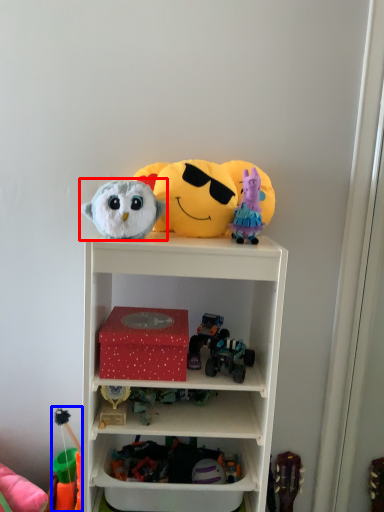
Question: Which object appears closest to the camera in this image, toy (highlighted by a red box) or toy (highlighted by a blue box)?

Choices:
 (A) toy
 (B) toy

Answer: (A)